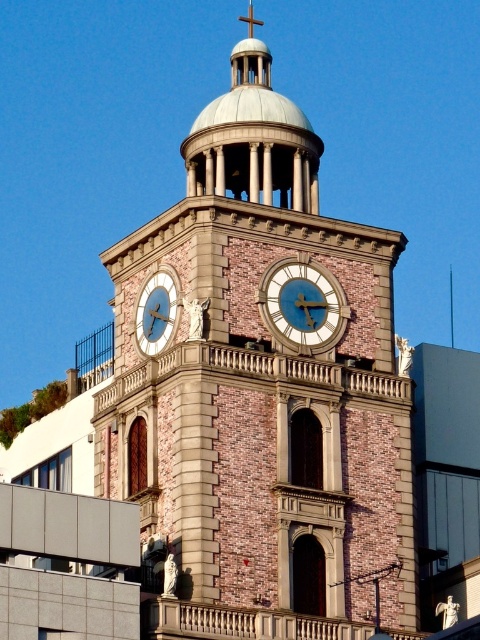
You are standing at the center of the image. Where is the brown brick clock tower at center located relative to your position?

The brown brick clock tower at center is located at point (260, 396) relative to your position.

You are an architect designing a new building and want to incorporate elements from this clock tower. If you need to ensure that the brick structure is wider than the clock face, which part of the brown brick clock tower at center and matte gold clock at center should you reference for proportions?

The brown brick clock tower at center is wider than the matte gold clock at center, so you should reference the tower for the brick structure width and the clock for the clock face dimensions to maintain the proportion.

You are standing at point A, which is at coordinates (260,396). What structure are you directly in front of?

You are directly in front of the brown brick clock tower at center located at point (260,396).